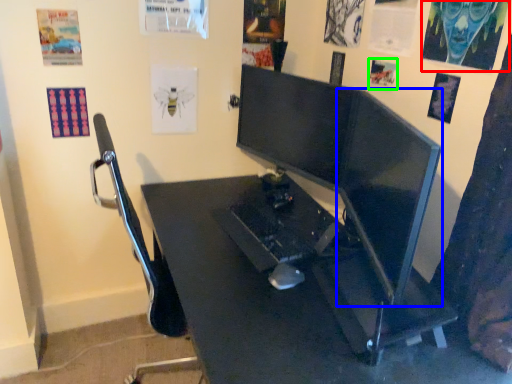
Question: Which object is the closest to the poster page (highlighted by a red box)? Choose among these: computer monitor (highlighted by a blue box) or poster page (highlighted by a green box).

Choices:
 (A) computer monitor
 (B) poster page

Answer: (B)